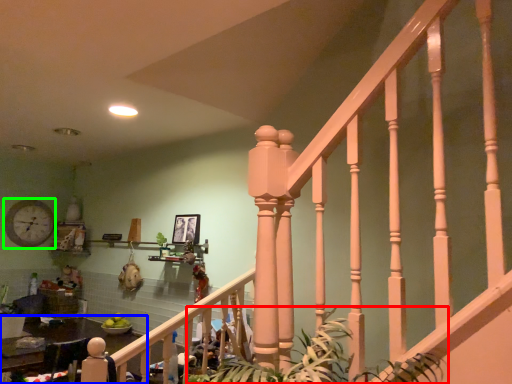
Question: Which is nearer to the plant (highlighted by a red box)? table (highlighted by a blue box) or clock (highlighted by a green box).

Choices:
 (A) table
 (B) clock

Answer: (A)